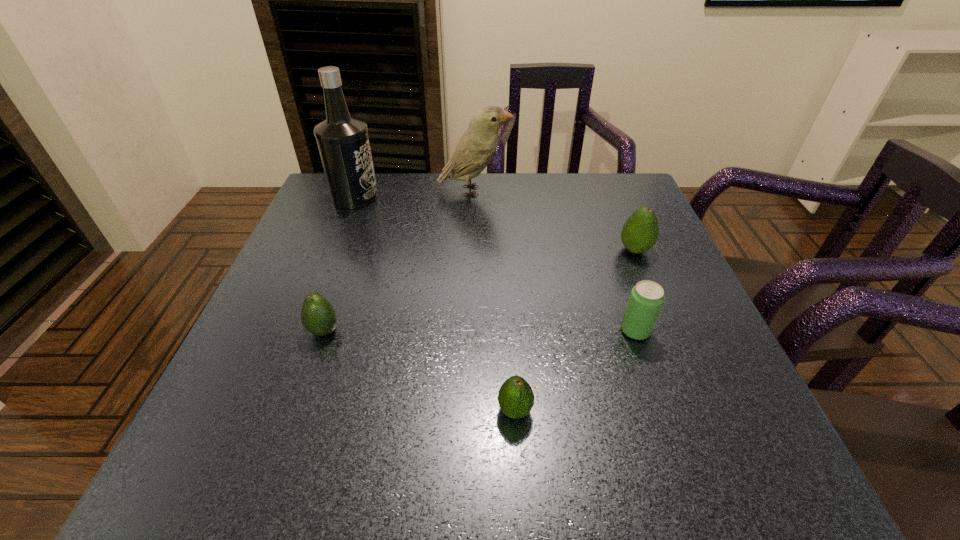
Find the location of a particular element. The width and height of the screenshot is (960, 540). object present at the far left corner is located at coordinates (343, 142).

Find the location of a particular element. This screenshot has width=960, height=540. free region at the far edge is located at coordinates (507, 218).

Where is `free space at the near edge of the desktop`? The width and height of the screenshot is (960, 540). free space at the near edge of the desktop is located at coordinates (339, 487).

In the image, there is a desktop. Identify the location of free space at the left edge. The image size is (960, 540). (335, 285).

The width and height of the screenshot is (960, 540). What are the coordinates of `free space at the right edge` in the screenshot? It's located at (711, 370).

At what (x,y) coordinates should I click in order to perform the action: click on vacant space at the far left corner. Please return your answer as a coordinate pair (x, y). Looking at the image, I should click on (316, 205).

At what (x,y) coordinates should I click in order to perform the action: click on free space at the near left corner of the desktop. Please return your answer as a coordinate pair (x, y). Image resolution: width=960 pixels, height=540 pixels. Looking at the image, I should click on click(249, 480).

Locate an element on the screen. free spot between the soda and the bird is located at coordinates (555, 261).

Identify the location of vacant space that is in between the second avocado from left to right and the bird. point(494,301).

You are a GUI agent. You are given a task and a screenshot of the screen. Output one action in this format:
    pyautogui.click(x=<x>, y=<y>)
    Task: Click on the vacant space that's between the rightmost avocado and the second tallest object
    Image resolution: width=960 pixels, height=540 pixels.
    Given the screenshot: What is the action you would take?
    pyautogui.click(x=555, y=220)